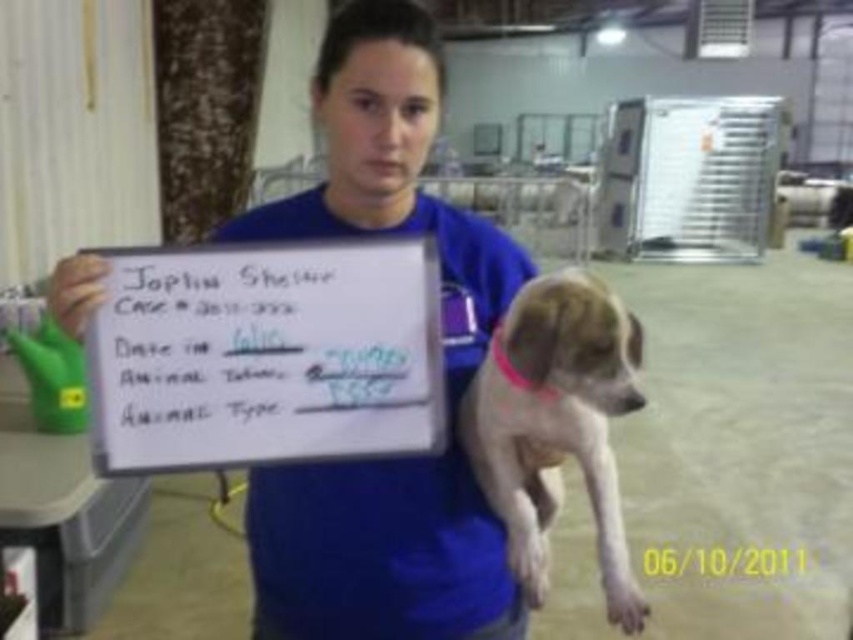
Question: Observing the image, what is the correct spatial positioning of white paper at center in reference to light brown fur at center?

Choices:
 (A) above
 (B) below

Answer: (A)

Question: Is white paper at center positioned behind light brown fur at center?

Choices:
 (A) yes
 (B) no

Answer: (A)

Question: Based on their relative distances, which object is nearer to the light brown fur at center?

Choices:
 (A) white paper at center
 (B) blue fabric shirt at center

Answer: (B)

Question: Based on their relative distances, which object is farther from the light brown fur at center?

Choices:
 (A) white paper at center
 (B) blue fabric shirt at center

Answer: (A)

Question: Which is nearer to the blue fabric shirt at center?

Choices:
 (A) light brown fur at center
 (B) white paper at center

Answer: (B)

Question: Is blue fabric shirt at center closer to camera compared to white paper at center?

Choices:
 (A) yes
 (B) no

Answer: (A)